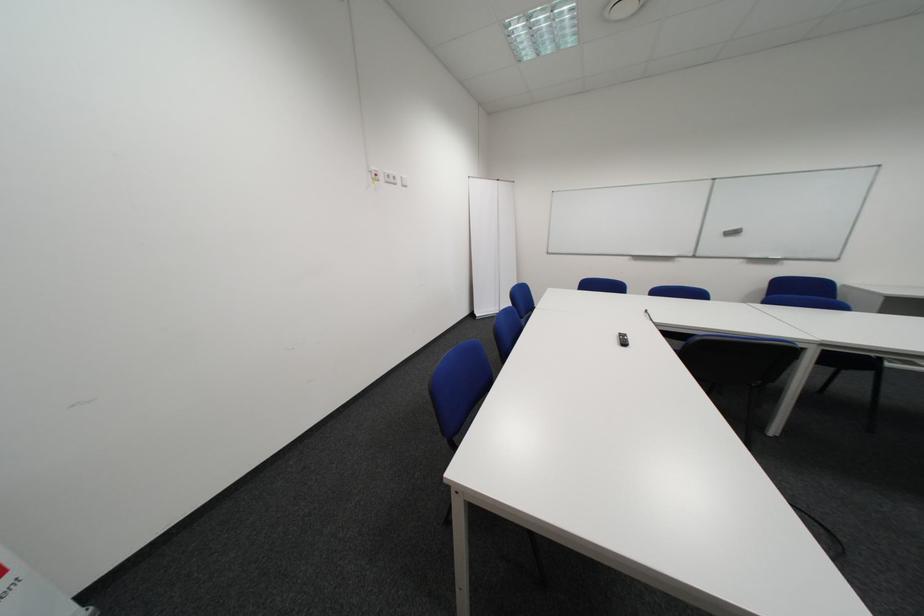
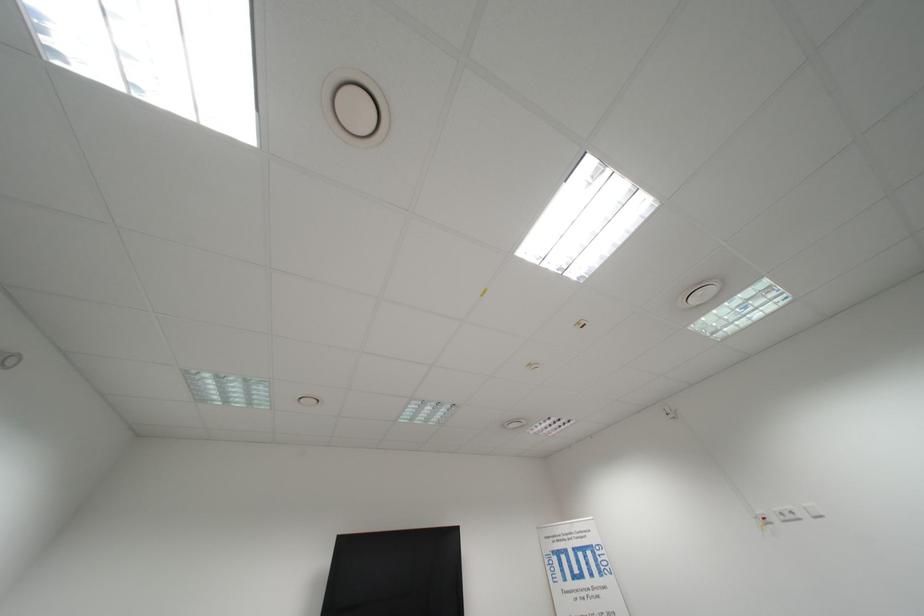
The point at (412,179) is marked in the first image. Where is the corresponding point in the second image?

(818, 509)